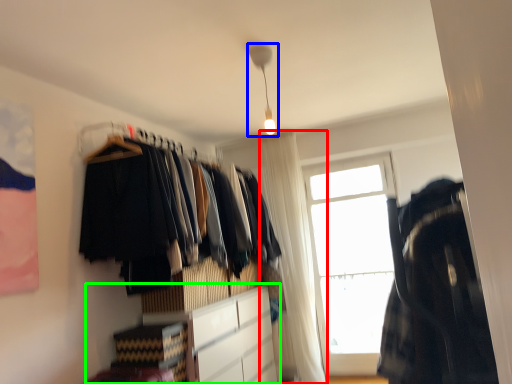
Question: Based on their relative distances, which object is farther from curtain (highlighted by a red box)? Choose from light fixture (highlighted by a blue box) and cabinetry (highlighted by a green box).

Choices:
 (A) light fixture
 (B) cabinetry

Answer: (A)